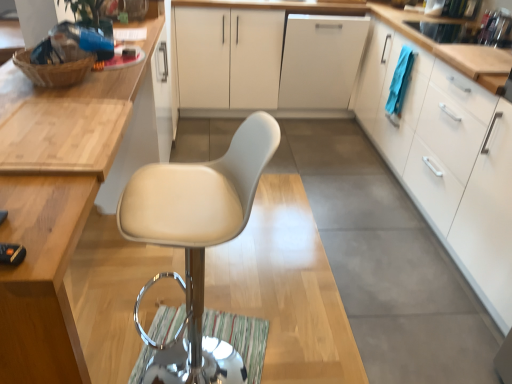
Question: From the image's perspective, is white matte cabinet at center above white matte cabinet at right, which is the third cabinetry in left-to-right order?

Choices:
 (A) no
 (B) yes

Answer: (B)

Question: Could you tell me if white matte cabinet at center is facing white matte cabinet at right, acting as the 1th cabinetry starting from the right?

Choices:
 (A) no
 (B) yes

Answer: (A)

Question: Is white matte cabinet at center next to white matte cabinet at right, acting as the 1th cabinetry starting from the right?

Choices:
 (A) no
 (B) yes

Answer: (A)

Question: Is white matte cabinet at center to the right of white matte cabinet at right, acting as the 1th cabinetry starting from the right, from the viewer's perspective?

Choices:
 (A) yes
 (B) no

Answer: (B)

Question: Is white matte cabinet at center far from white matte cabinet at right, which is the third cabinetry in left-to-right order?

Choices:
 (A) yes
 (B) no

Answer: (A)

Question: In terms of width, does white leather chair at center look wider or thinner when compared to white matte cabinet at center, positioned as the 2th cabinetry in left-to-right order?

Choices:
 (A) wide
 (B) thin

Answer: (B)

Question: Based on their sizes in the image, would you say white leather chair at center is bigger or smaller than white matte cabinet at center, acting as the second cabinetry starting from the right?

Choices:
 (A) small
 (B) big

Answer: (A)

Question: Is white leather chair at center taller or shorter than white matte cabinet at center, positioned as the 2th cabinetry in left-to-right order?

Choices:
 (A) short
 (B) tall

Answer: (B)

Question: Choose the correct answer: Is white leather chair at center inside white matte cabinet at center, positioned as the 2th cabinetry in left-to-right order, or outside it?

Choices:
 (A) inside
 (B) outside

Answer: (B)

Question: Looking at the image, does matte wood cabinet at upper left, positioned as the 3th cabinetry in right-to-left order, seem bigger or smaller compared to white leather chair at center?

Choices:
 (A) big
 (B) small

Answer: (A)

Question: Relative to white leather chair at center, is matte wood cabinet at upper left, positioned as the 3th cabinetry in right-to-left order, in front or behind?

Choices:
 (A) front
 (B) behind

Answer: (A)

Question: Would you say matte wood cabinet at upper left, positioned as the 3th cabinetry in right-to-left order, is to the left or to the right of white leather chair at center in the picture?

Choices:
 (A) right
 (B) left

Answer: (B)

Question: Considering the positions of matte wood cabinet at upper left, positioned as the 3th cabinetry in right-to-left order, and white leather chair at center in the image, is matte wood cabinet at upper left, positioned as the 3th cabinetry in right-to-left order, wider or thinner than white leather chair at center?

Choices:
 (A) thin
 (B) wide

Answer: (B)

Question: From the image's perspective, relative to white matte cabinet at right, acting as the 1th cabinetry starting from the right, is white leather chair at center above or below?

Choices:
 (A) above
 (B) below

Answer: (B)

Question: From a real-world perspective, is white leather chair at center positioned above or below white matte cabinet at right, which is the third cabinetry in left-to-right order?

Choices:
 (A) below
 (B) above

Answer: (B)